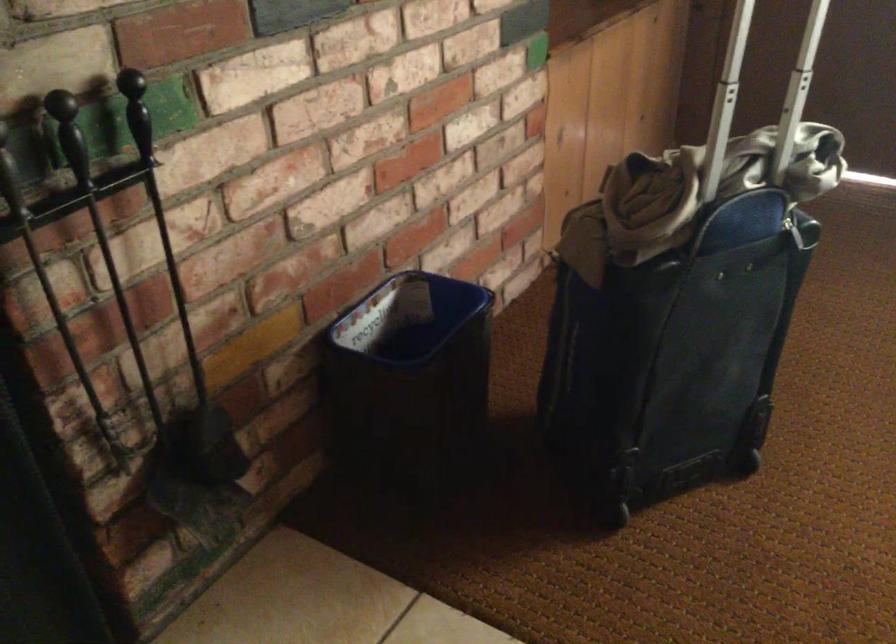
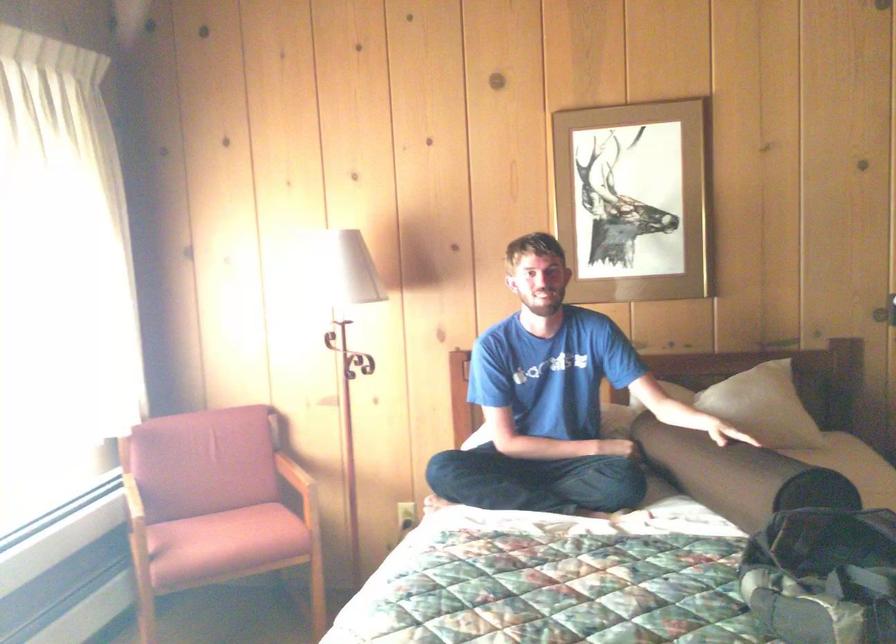
Question: The first image is from the beginning of the video and the second image is from the end. How did the camera likely rotate when shooting the video?

Choices:
 (A) Left
 (B) Right
 (C) Up
 (D) Down

Answer: (B)